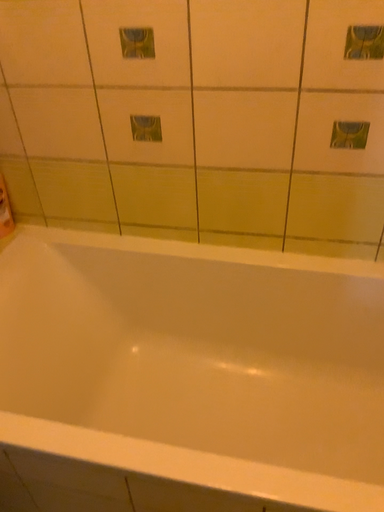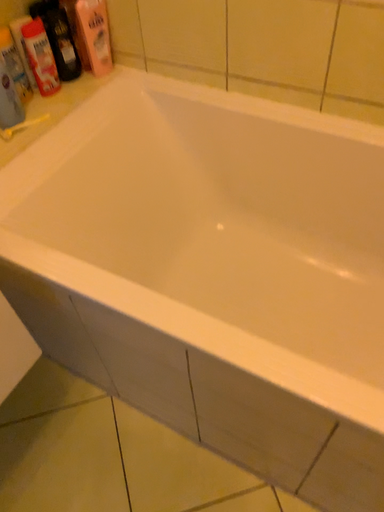
Question: Which way did the camera rotate in the video?

Choices:
 (A) rotated downward
 (B) rotated upward

Answer: (A)